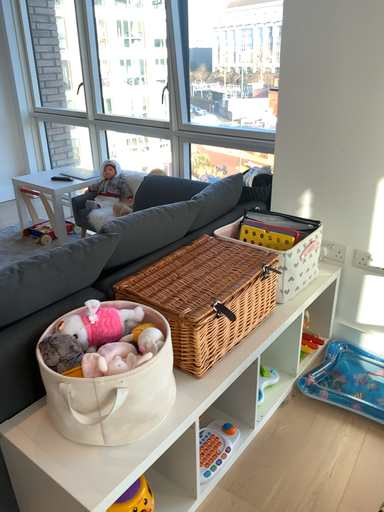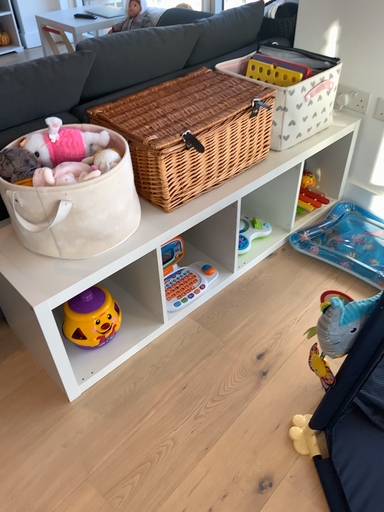
Question: How did the camera likely rotate when shooting the video?

Choices:
 (A) rotated downward
 (B) rotated upward

Answer: (A)